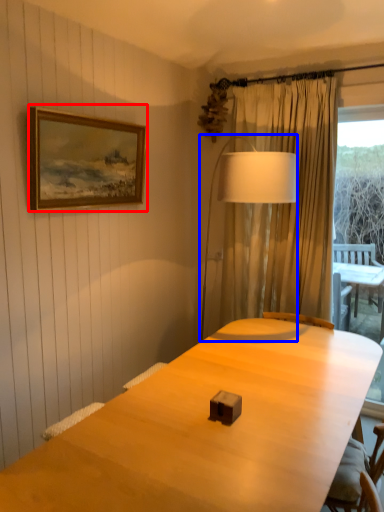
Question: Which object appears farthest to the camera in this image, picture frame (highlighted by a red box) or table lamp (highlighted by a blue box)?

Choices:
 (A) picture frame
 (B) table lamp

Answer: (B)